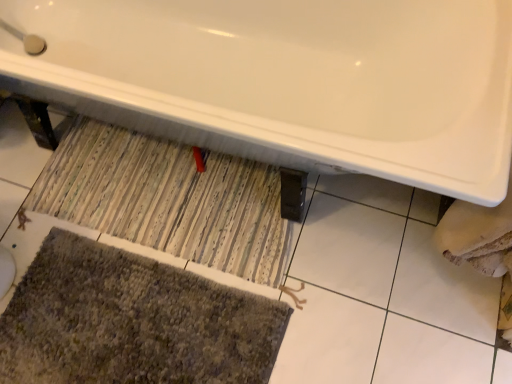
Question: From the image's perspective, is striped fabric doormat at center located above or below white glossy bathtub at upper center?

Choices:
 (A) below
 (B) above

Answer: (A)

Question: Is point (94, 182) positioned closer to the camera than point (141, 38)?

Choices:
 (A) farther
 (B) closer

Answer: (B)

Question: Which is farther from the striped fabric doormat at center?

Choices:
 (A) textured gray bath mat at lower left
 (B) white glossy bathtub at upper center

Answer: (B)

Question: Estimate the real-world distances between objects in this image. Which object is farther from the textured gray bath mat at lower left?

Choices:
 (A) striped fabric doormat at center
 (B) white glossy bathtub at upper center

Answer: (B)